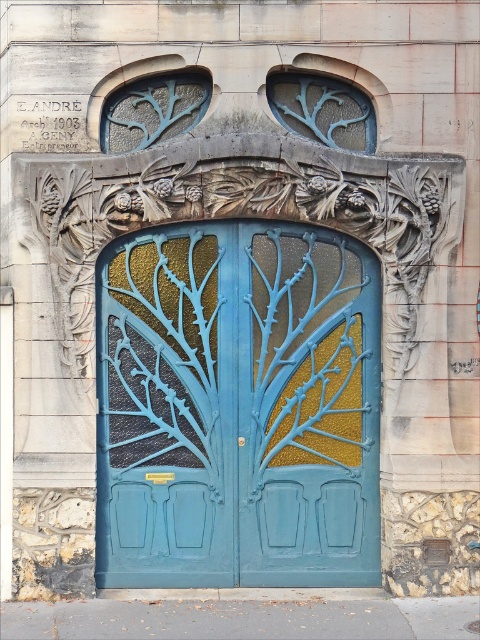
Identify the location of matte blue metal door at center. Image resolution: width=480 pixels, height=640 pixels. (238, 408).

Consider the image. Is matte blue metal door at center smaller than translucent blue glass at upper left?

No.

What do you see at coordinates (238, 408) in the screenshot?
I see `matte blue metal door at center` at bounding box center [238, 408].

Where is `matte blue metal door at center`? Image resolution: width=480 pixels, height=640 pixels. matte blue metal door at center is located at coordinates (238, 408).

Is translucent blue glass at upper left thinner than blue glass at upper center?

Indeed, translucent blue glass at upper left has a lesser width compared to blue glass at upper center.

Can you confirm if translucent blue glass at upper left is positioned to the left of blue glass at upper center?

Indeed, translucent blue glass at upper left is positioned on the left side of blue glass at upper center.

Is point (104, 108) closer to camera compared to point (322, 116)?

Yes, point (104, 108) is closer to viewer.

At what (x,y) coordinates should I click in order to perform the action: click on translucent blue glass at upper left. Please return your answer as a coordinate pair (x, y). The image size is (480, 640). Looking at the image, I should click on (154, 109).

Is point (348, 520) positioned after point (340, 93)?

No, it is in front of (340, 93).

Is matte blue metal door at center bigger than blue glass at upper center?

Correct, matte blue metal door at center is larger in size than blue glass at upper center.

Who is more forward, (200, 525) or (300, 93)?

Point (200, 525) is more forward.

Identify the location of matte blue metal door at center. The width and height of the screenshot is (480, 640). click(x=238, y=408).